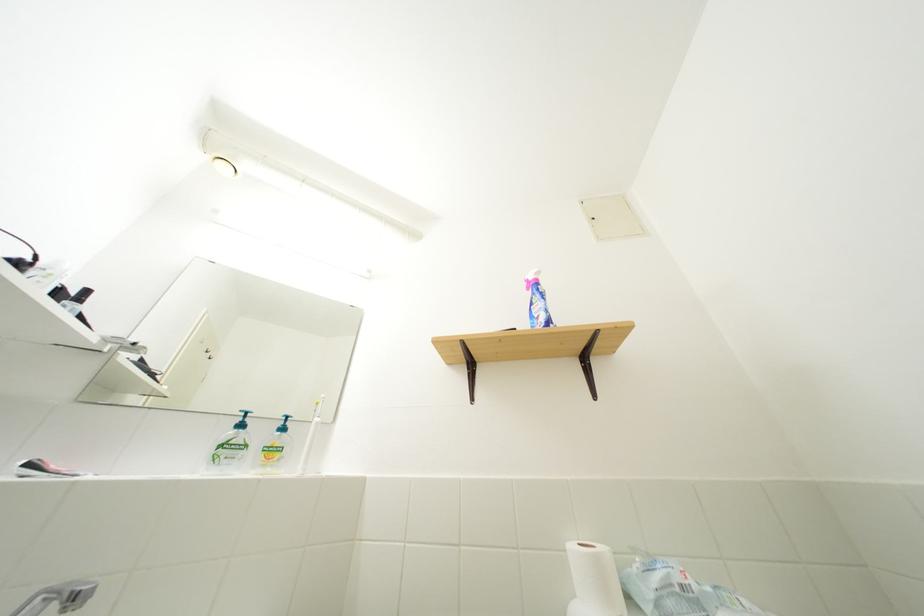
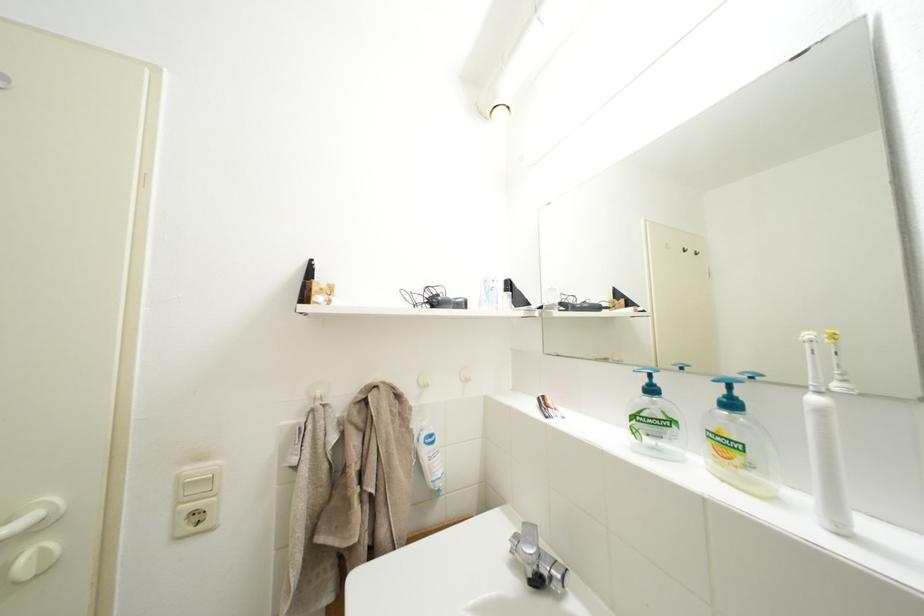
Question: The camera is either moving clockwise (left) or counter-clockwise (right) around the object. The first image is from the beginning of the video and the second image is from the end. Is the camera moving left or right when shooting the video?

Choices:
 (A) Left
 (B) Right

Answer: (B)